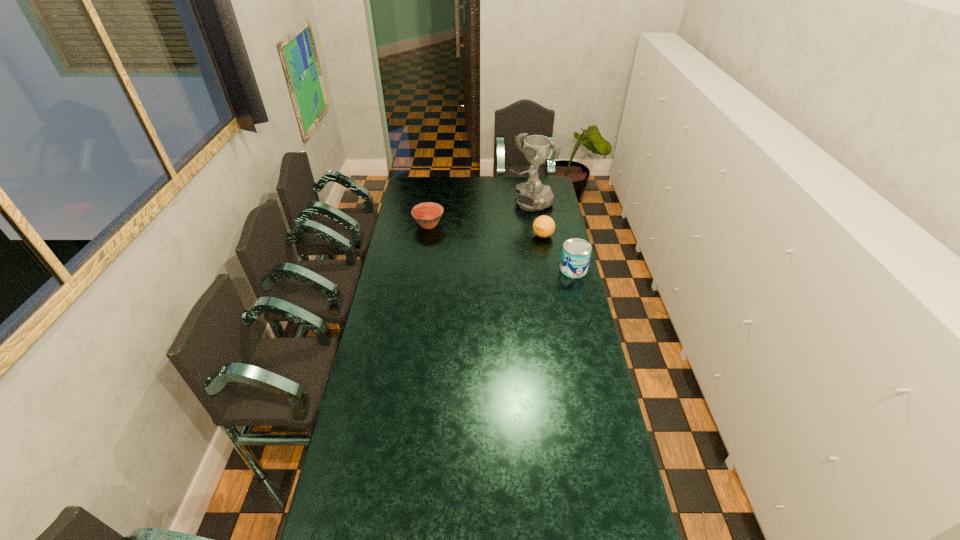
Find the location of a particular element. Image resolution: width=960 pixels, height=540 pixels. vacant area between the second tallest object and the shortest object is located at coordinates (501, 247).

Where is `free point between the leftmost object and the award`? This screenshot has height=540, width=960. free point between the leftmost object and the award is located at coordinates (479, 214).

At what (x,y) coordinates should I click in order to perform the action: click on unoccupied area between the can and the ping-pong ball. Please return your answer as a coordinate pair (x, y). The height and width of the screenshot is (540, 960). Looking at the image, I should click on (558, 253).

Identify the location of vacant space in between the third tallest object and the shortest object. This screenshot has height=540, width=960. (486, 230).

You are a GUI agent. You are given a task and a screenshot of the screen. Output one action in this format:
    pyautogui.click(x=<x>, y=<y>)
    Task: Click on the empty location between the award and the leftmost object
    
    Given the screenshot: What is the action you would take?
    pyautogui.click(x=479, y=214)

You are a GUI agent. You are given a task and a screenshot of the screen. Output one action in this format:
    pyautogui.click(x=<x>, y=<y>)
    Task: Click on the vacant area that lies between the third tallest object and the leftmost object
    
    Given the screenshot: What is the action you would take?
    pyautogui.click(x=486, y=230)

This screenshot has width=960, height=540. In order to click on object that is the closest one to the nearest object in this screenshot , I will do `click(543, 226)`.

Find the location of a particular element. The image size is (960, 540). object that stands as the third closest to the tallest object is located at coordinates (576, 252).

Image resolution: width=960 pixels, height=540 pixels. What are the coordinates of `vacant space that satisfies the following two spatial constraints: 1. on the front side of the can; 2. on the left side of the shortest object` in the screenshot? It's located at (422, 269).

Where is `free space that satisfies the following two spatial constraints: 1. on the front side of the ping-pong ball; 2. on the right side of the bowl`? free space that satisfies the following two spatial constraints: 1. on the front side of the ping-pong ball; 2. on the right side of the bowl is located at coordinates (427, 235).